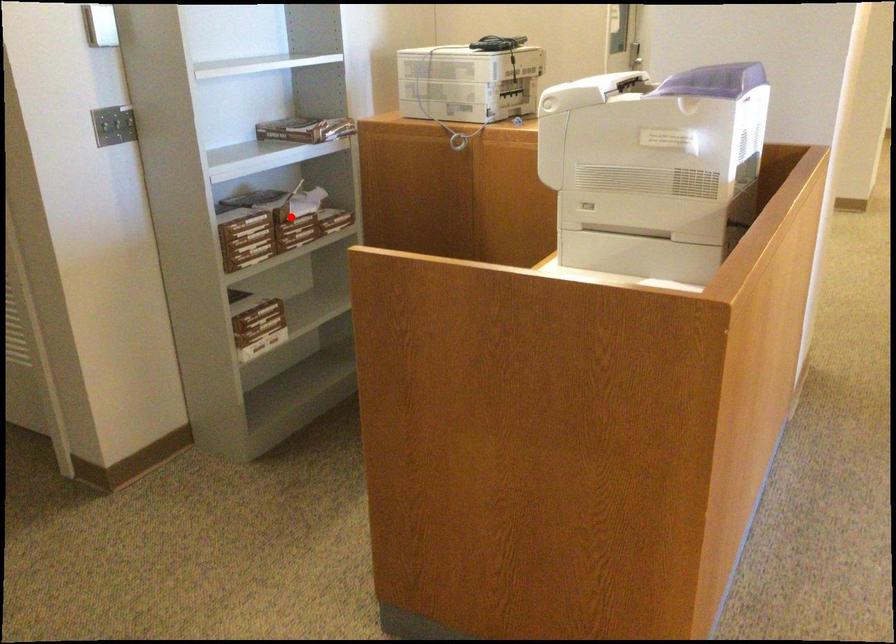
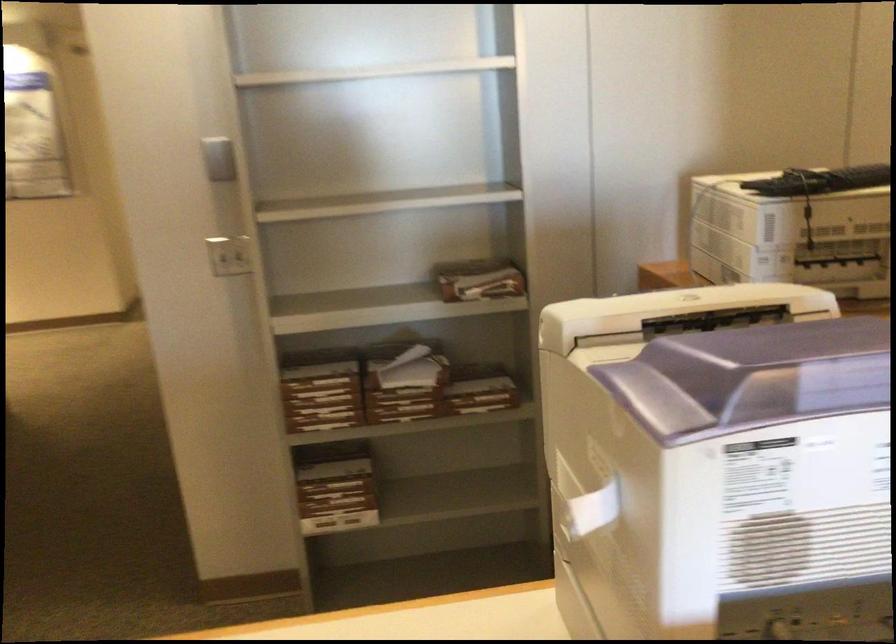
Locate, in the second image, the point that corresponds to the highlighted location in the first image.

(398, 389)